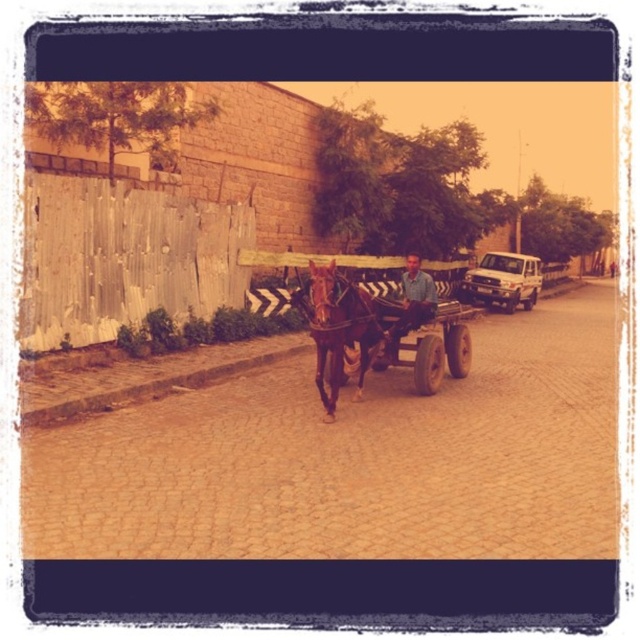
Question: Does brown wooden cart at center appear on the right side of brown glossy horse at center?

Choices:
 (A) yes
 (B) no

Answer: (B)

Question: Which of the following is the closest to the observer?

Choices:
 (A) (387, 339)
 (B) (321, 330)
 (C) (323, 317)
 (D) (522, 253)

Answer: (C)

Question: Where is brown glossy horse at center located in relation to matte blue shirt at center in the image?

Choices:
 (A) below
 (B) above

Answer: (A)

Question: Does brown wooden cart at center come in front of white matte truck at right?

Choices:
 (A) no
 (B) yes

Answer: (B)

Question: Among these points, which one is farthest from the camera?

Choices:
 (A) (394, 312)
 (B) (516, 273)
 (C) (317, 385)
 (D) (380, 364)

Answer: (B)

Question: Which object appears closest to the camera in this image?

Choices:
 (A) matte blue shirt at center
 (B) white matte truck at right
 (C) brown glossy horse at center
 (D) brown wooden cart at center

Answer: (C)